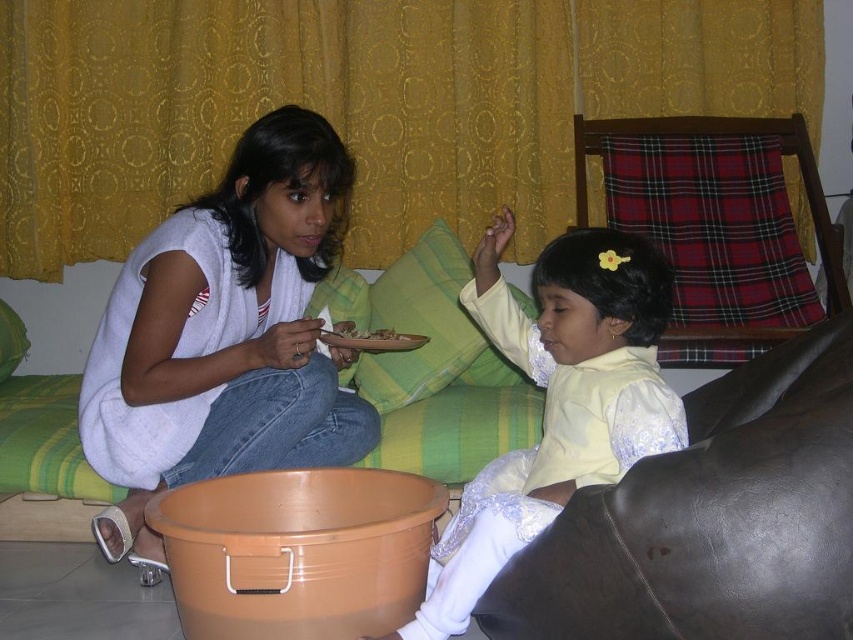
Question: Does matte yellow dress at center have a smaller size compared to smooth brown plate at center?

Choices:
 (A) no
 (B) yes

Answer: (A)

Question: Which object is the closest to the matte yellow dress at center?

Choices:
 (A) matte white sweater at center
 (B) silky yellow dress at center

Answer: (B)

Question: Is matte yellow dress at center positioned in front of silky yellow dress at center?

Choices:
 (A) yes
 (B) no

Answer: (A)

Question: Based on their relative distances, which object is nearer to the matte white sweater at center?

Choices:
 (A) smooth brown plate at center
 (B) matte yellow dress at center
 (C) silky yellow dress at center

Answer: (A)

Question: Estimate the real-world distances between objects in this image. Which object is farther from the matte yellow dress at center?

Choices:
 (A) smooth brown plate at center
 (B) matte white sweater at center
 (C) silky yellow dress at center

Answer: (B)

Question: Is the position of matte white sweater at center less distant than that of matte yellow dress at center?

Choices:
 (A) no
 (B) yes

Answer: (A)